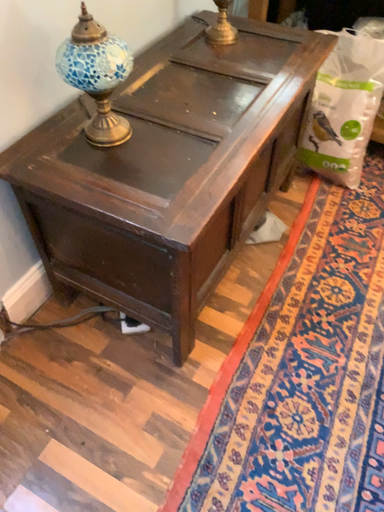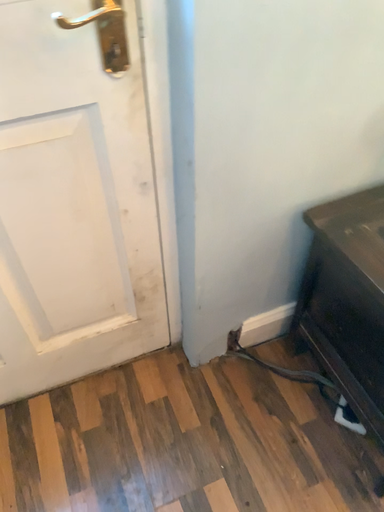
Question: How did the camera likely rotate when shooting the video?

Choices:
 (A) rotated left
 (B) rotated right

Answer: (A)